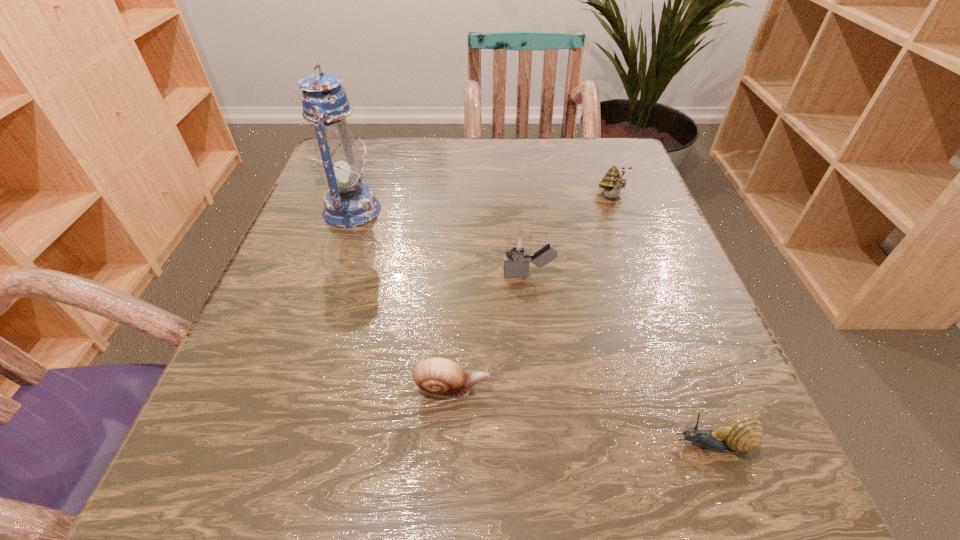
The width and height of the screenshot is (960, 540). In order to click on escargot that stands as the third closest to the tallest object in this screenshot , I will do `click(742, 433)`.

Identify which escargot is located as the third nearest to the third nearest object. Please provide its 2D coordinates. Your answer should be formatted as a tuple, i.e. [(x, y)], where the tuple contains the x and y coordinates of a point satisfying the conditions above.

[(742, 433)]

The image size is (960, 540). I want to click on free space that satisfies the following two spatial constraints: 1. on the face of the farthest escargot; 2. on the front-facing side of the second nearest object, so click(x=682, y=389).

You are a GUI agent. You are given a task and a screenshot of the screen. Output one action in this format:
    pyautogui.click(x=<x>, y=<y>)
    Task: Click on the free spot that satisfies the following two spatial constraints: 1. on the face of the tallest escargot; 2. on the front-facing side of the tallest object
    The width and height of the screenshot is (960, 540).
    Given the screenshot: What is the action you would take?
    pyautogui.click(x=616, y=210)

Where is `free spot that satisfies the following two spatial constraints: 1. on the face of the farthest escargot; 2. on the front-facing side of the fourth farthest object`? free spot that satisfies the following two spatial constraints: 1. on the face of the farthest escargot; 2. on the front-facing side of the fourth farthest object is located at coordinates (682, 389).